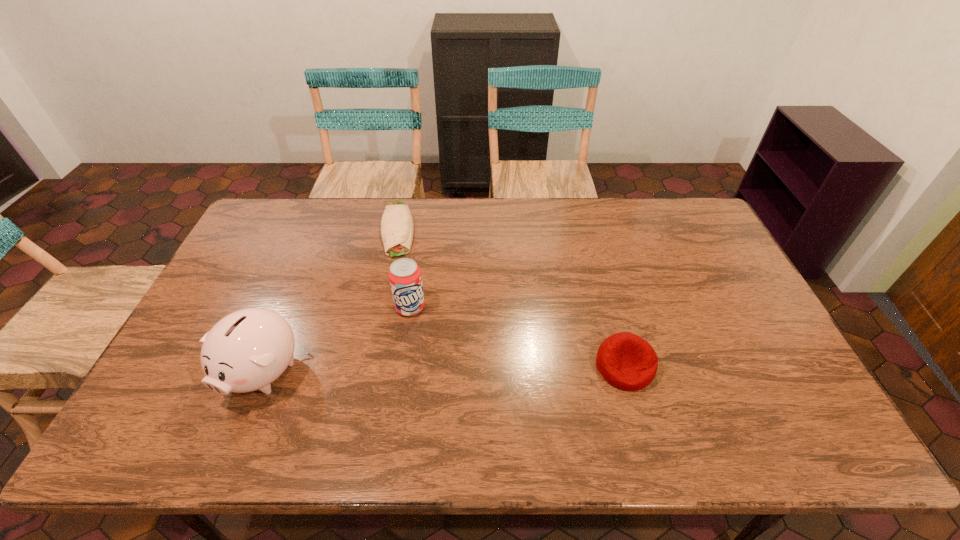
Locate an element on the screen. free space located at the bitten end of the burrito is located at coordinates (395, 280).

Image resolution: width=960 pixels, height=540 pixels. In order to click on vacant space located at the bitten end of the burrito in this screenshot , I will do `click(395, 287)`.

Find the location of `vacant space located on the surface of the soda can`. vacant space located on the surface of the soda can is located at coordinates (404, 386).

Identify the location of vacant space located 0.070m on the surface of the soda can. (408, 338).

Locate an element on the screen. free location located 0.140m on the surface of the soda can is located at coordinates pyautogui.click(x=406, y=359).

Locate an element on the screen. The height and width of the screenshot is (540, 960). object that is at the far edge is located at coordinates point(397,227).

You are a GUI agent. You are given a task and a screenshot of the screen. Output one action in this format:
    pyautogui.click(x=<x>, y=<y>)
    Task: Click on the piggy bank that is at the near edge
    
    Given the screenshot: What is the action you would take?
    [247, 350]

You are a GUI agent. You are given a task and a screenshot of the screen. Output one action in this format:
    pyautogui.click(x=<x>, y=<y>)
    Task: Click on the beanbag situated at the near edge
    
    Given the screenshot: What is the action you would take?
    pyautogui.click(x=625, y=360)

Image resolution: width=960 pixels, height=540 pixels. Find the location of `object located at the left edge`. object located at the left edge is located at coordinates (247, 350).

Find the location of `object at the near left corner`. object at the near left corner is located at coordinates (247, 350).